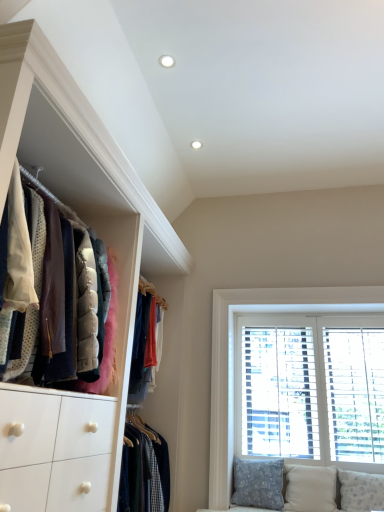
Question: Does velvet jackets at left lie in front of patterned fabric pillow at lower right, the 3th pillow in the right-to-left sequence?

Choices:
 (A) no
 (B) yes

Answer: (B)

Question: Does velvet jackets at left have a greater width compared to patterned fabric pillow at lower right, the 3th pillow in the right-to-left sequence?

Choices:
 (A) no
 (B) yes

Answer: (B)

Question: Is velvet jackets at left positioned beyond the bounds of patterned fabric pillow at lower right, the 1th pillow in the left-to-right sequence?

Choices:
 (A) yes
 (B) no

Answer: (A)

Question: Is patterned fabric pillow at lower right, the 1th pillow in the left-to-right sequence, located within velvet jackets at left?

Choices:
 (A) no
 (B) yes

Answer: (A)

Question: From the image's perspective, is velvet jackets at left located beneath patterned fabric pillow at lower right, the 1th pillow in the left-to-right sequence?

Choices:
 (A) no
 (B) yes

Answer: (A)

Question: Based on their positions, is white textured pillow at lower right, the first pillow positioned from the right, located to the left or right of white wood window at right?

Choices:
 (A) left
 (B) right

Answer: (B)

Question: From the image's perspective, is white textured pillow at lower right, acting as the third pillow starting from the left, above or below white wood window at right?

Choices:
 (A) above
 (B) below

Answer: (B)

Question: Is white textured pillow at lower right, acting as the third pillow starting from the left, taller or shorter than white wood window at right?

Choices:
 (A) short
 (B) tall

Answer: (A)

Question: Choose the correct answer: Is white textured pillow at lower right, the first pillow positioned from the right, inside white wood window at right or outside it?

Choices:
 (A) inside
 (B) outside

Answer: (B)

Question: In terms of size, does white textured pillow at lower right, acting as the third pillow starting from the left, appear bigger or smaller than patterned fabric pillow at lower right, the 1th pillow in the left-to-right sequence?

Choices:
 (A) big
 (B) small

Answer: (B)

Question: Is white textured pillow at lower right, acting as the third pillow starting from the left, wider or thinner than patterned fabric pillow at lower right, the 1th pillow in the left-to-right sequence?

Choices:
 (A) thin
 (B) wide

Answer: (A)

Question: Which is correct: white textured pillow at lower right, the first pillow positioned from the right, is inside patterned fabric pillow at lower right, the 1th pillow in the left-to-right sequence, or outside of it?

Choices:
 (A) outside
 (B) inside

Answer: (A)

Question: Is point (367, 495) positioned closer to the camera than point (233, 477)?

Choices:
 (A) farther
 (B) closer

Answer: (B)

Question: From a real-world perspective, relative to white textured pillow at lower right, the first pillow positioned from the right, is velvet jackets at left vertically above or below?

Choices:
 (A) below
 (B) above

Answer: (B)

Question: In the image, is velvet jackets at left on the left side or the right side of white textured pillow at lower right, acting as the third pillow starting from the left?

Choices:
 (A) right
 (B) left

Answer: (B)